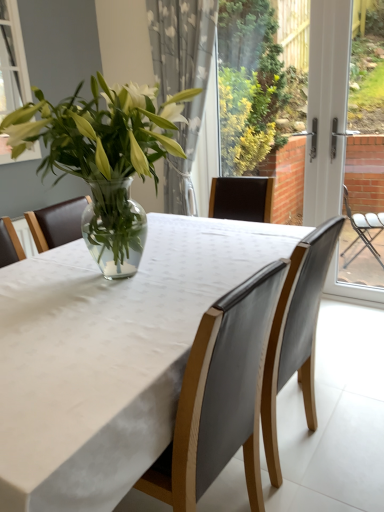
Locate an element on the screen. This screenshot has height=512, width=384. free space above white fabric table at center (from a real-world perspective) is located at coordinates (127, 290).